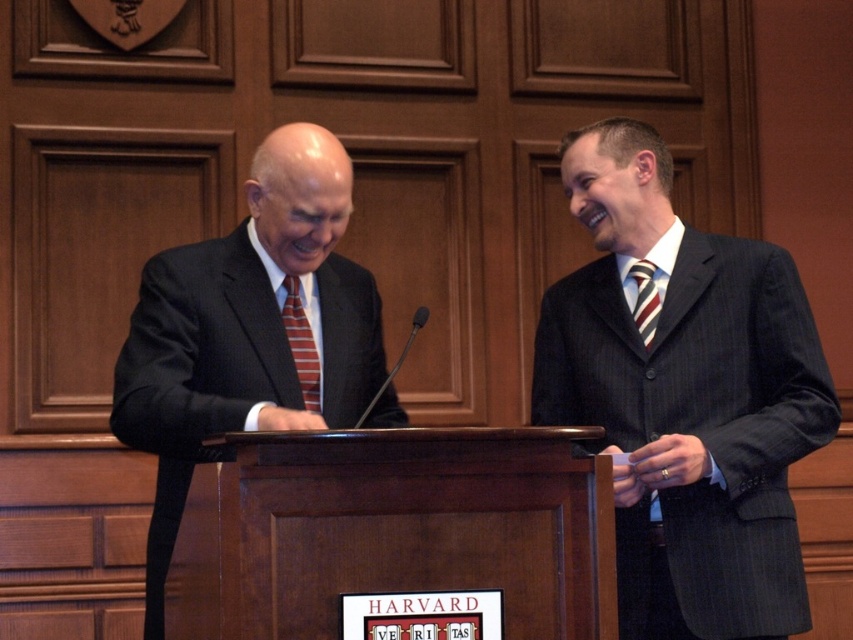
Question: Based on their relative distances, which object is nearer to the striped fabric tie at left?

Choices:
 (A) dark pinstripe suit at right
 (B) matte black suit at center
 (C) striped fabric tie at right
 (D) wooden podium at center

Answer: (B)

Question: Can you confirm if dark pinstripe suit at right is positioned to the right of striped fabric tie at right?

Choices:
 (A) no
 (B) yes

Answer: (B)

Question: Which of the following is the closest to the observer?

Choices:
 (A) dark pinstripe suit at right
 (B) wooden podium at center
 (C) striped fabric tie at right
 (D) striped fabric tie at left

Answer: (B)

Question: Which point is closer to the camera taking this photo?

Choices:
 (A) (705, 488)
 (B) (300, 349)
 (C) (231, 324)

Answer: (C)

Question: Can you confirm if striped fabric tie at left is positioned to the left of striped fabric tie at right?

Choices:
 (A) yes
 (B) no

Answer: (A)

Question: Where is matte black suit at center located in relation to striped fabric tie at right in the image?

Choices:
 (A) above
 (B) below

Answer: (B)